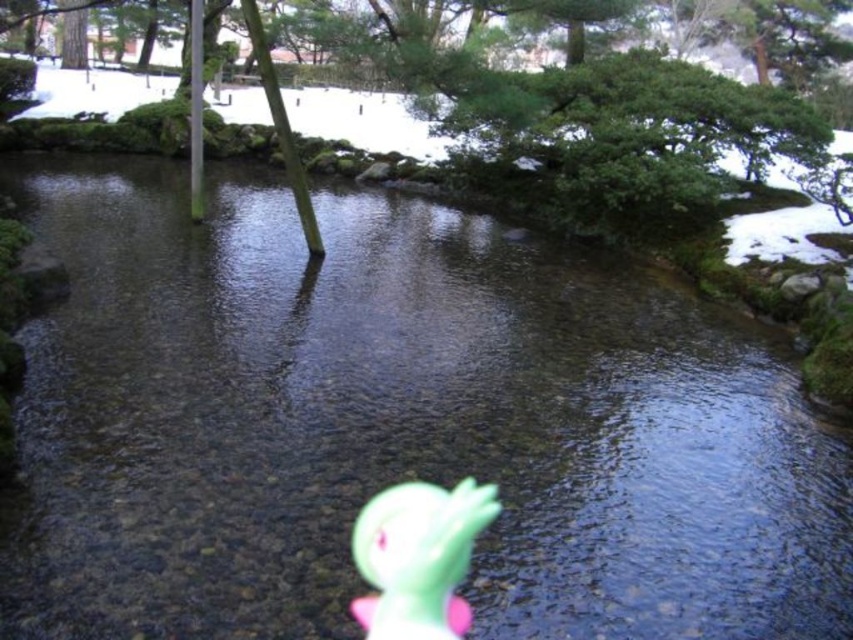
From the picture: Does green rubber duck at lower center appear under green leafy tree at center?

Yes.

You are a GUI agent. You are given a task and a screenshot of the screen. Output one action in this format:
    pyautogui.click(x=<x>, y=<y>)
    Task: Click on the green rubber duck at lower center
    This screenshot has height=640, width=853.
    Given the screenshot: What is the action you would take?
    pyautogui.click(x=418, y=557)

In order to click on green rubber duck at lower center in this screenshot , I will do `click(418, 557)`.